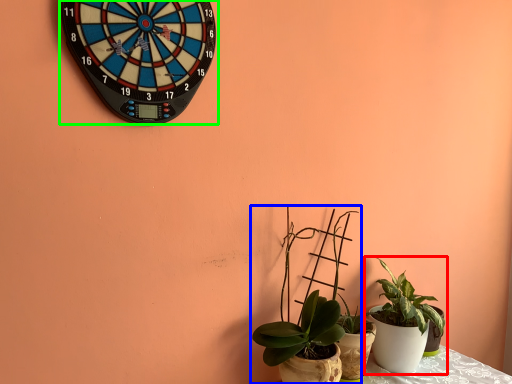
Question: Based on their relative distances, which object is farther from houseplant (highlighted by a red box)? Choose from houseplant (highlighted by a blue box) and wall clock (highlighted by a green box).

Choices:
 (A) houseplant
 (B) wall clock

Answer: (B)